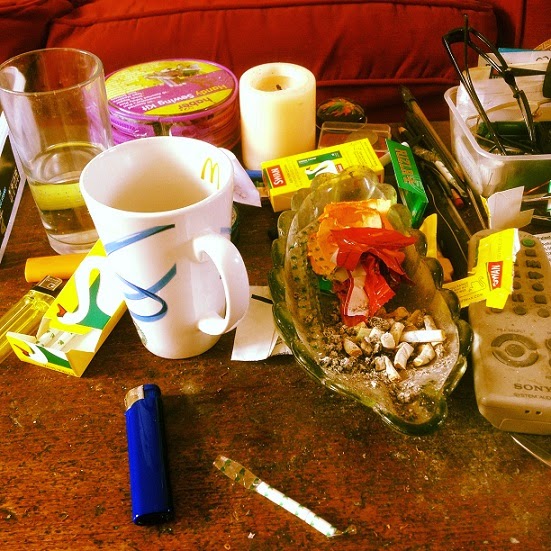
You are a GUI agent. You are given a task and a screenshot of the screen. Output one action in this format:
    pyautogui.click(x=<x>, y=<y>)
    Task: Click on the pen
    
    Given the screenshot: What is the action you would take?
    pyautogui.click(x=433, y=131), pyautogui.click(x=426, y=134), pyautogui.click(x=406, y=133)